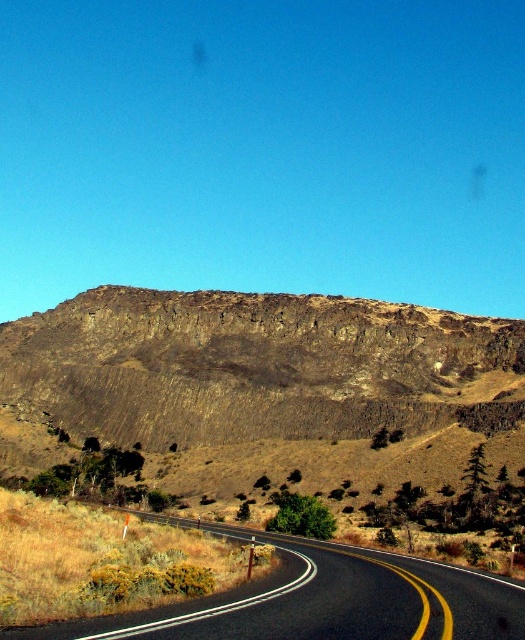
You are a hiker planning to take a photo of the black asphalt road at center and the brown rocky hill at upper center. From which direction should you position yourself to ensure both objects are visible in the frame?

Since the brown rocky hill at upper center is positioned over the black asphalt road at center, you should position yourself below the brown rocky hill at upper center to capture both objects in the frame.

You are a hiker planning to take a photo of the black asphalt road at center and the brown rocky hill at upper center. Which object should you focus on first if you want to capture both in a single frame without moving your camera?

You should focus on the brown rocky hill at upper center first because it is larger in size compared to the black asphalt road at center, allowing it to be more prominent in the frame.

You are a drone operator planning to fly a drone from the brown rocky hill at upper center to the black asphalt road at center. What is the approximate distance you need to cover?

The brown rocky hill at upper center and black asphalt road at center are 250.41 feet apart, so the approximate distance to cover is 250.41 feet.